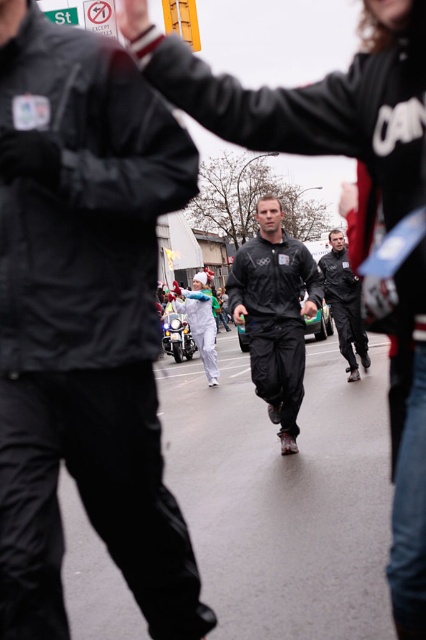
You are a photographer trying to capture both the matte black tracksuit at center and the black matte jacket at center in a single frame. Based on their positions, which object should you adjust your camera to focus on first to ensure both are in the shot?

The matte black tracksuit at center is to the left of black matte jacket at center. To capture both in a single frame, focus on the matte black tracksuit at center first as it is positioned further left, allowing the camera to encompass the entire span from left to right, ensuring both objects are included.

You are a photographer standing at the edge of the street capturing the scene. You want to take a photo that includes both the matte black tracksuit at center and the black matte jacket at center. Given the distance between them, do you need to adjust your camera lens to a wider angle to ensure both are fully visible in the frame?

The matte black tracksuit at center is 4.00 meters away from the black matte jacket at center. To capture both in the same frame, you would need to use a wider angle lens to accommodate the distance between them.